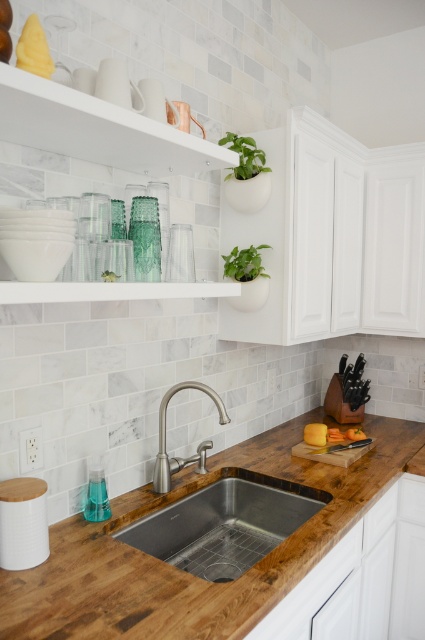
Consider the image. You are a chef preparing to place a tall soup pot on the wooden countertop at center. Considering the height of the green leafy plant at upper center, will the pot potentially hit the plant if placed in the center?

The wooden countertop at center is not as tall as the green leafy plant at upper center, meaning the plant is taller. Therefore, placing the soup pot on the countertop might not interfere with the plant since the plant is already taller and positioned above.

You are a kitchen designer planning to install a new faucet. The faucet requires a minimum of 24 inches of space between the sink and the plant to avoid water splashing. Based on the image, will the current distance between the stainless steel sink at center and the green matte plant at upper center meet this requirement?

The distance between the stainless steel sink at center and the green matte plant at upper center is 29.12 inches, which exceeds the required 24 inches. Therefore, the current spacing meets the requirement and the faucet installation should be feasible.

You are a kitchen designer planning to place a new appliance that requires a space wider than the green matte plant at upper center. Can the stainless steel sink at center accommodate this appliance?

The stainless steel sink at center is wider than the green matte plant at upper center, so it can accommodate the appliance requiring more width.